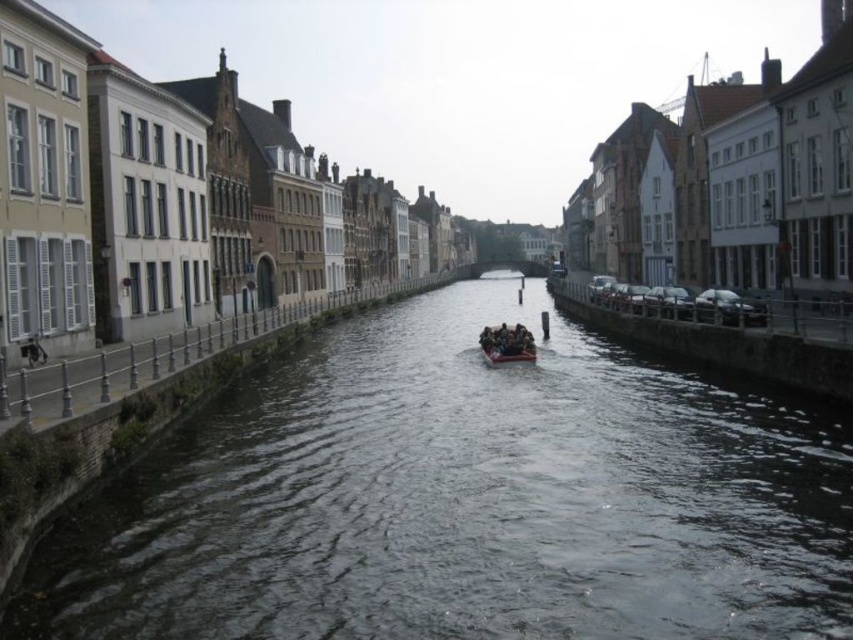
Question: Can you confirm if dark water at center is thinner than brown wooden raft at center?

Choices:
 (A) no
 (B) yes

Answer: (A)

Question: Which point is closer to the camera?

Choices:
 (A) brown wooden raft at center
 (B) dark water at center

Answer: (B)

Question: Which point is closer to the camera?

Choices:
 (A) brown wooden raft at center
 (B) dark water at center

Answer: (B)

Question: Is the position of dark water at center more distant than that of brown wooden raft at center?

Choices:
 (A) no
 (B) yes

Answer: (A)

Question: Which object is farther from the camera taking this photo?

Choices:
 (A) brown wooden raft at center
 (B) dark water at center

Answer: (A)

Question: Is dark water at center below brown wooden raft at center?

Choices:
 (A) yes
 (B) no

Answer: (A)